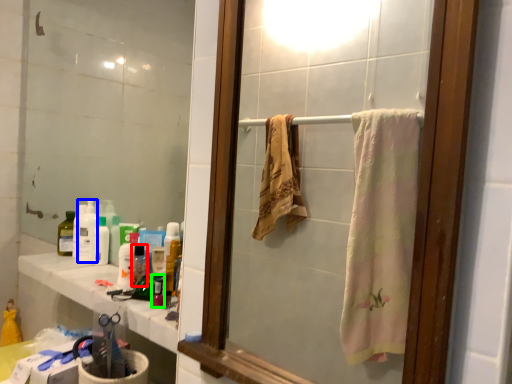
Question: Based on their relative distances, which object is nearer to bottle (highlighted by a red box)? Choose from cleaning product (highlighted by a blue box) and mouthwash (highlighted by a green box).

Choices:
 (A) cleaning product
 (B) mouthwash

Answer: (B)